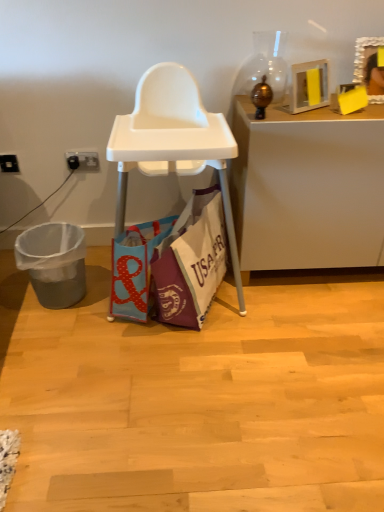
You are a GUI agent. You are given a task and a screenshot of the screen. Output one action in this format:
    pyautogui.click(x=<x>, y=<y>)
    Task: Click on the free space in front of white glossy desk at upper right
    This screenshot has height=512, width=384.
    Given the screenshot: What is the action you would take?
    pyautogui.click(x=313, y=339)